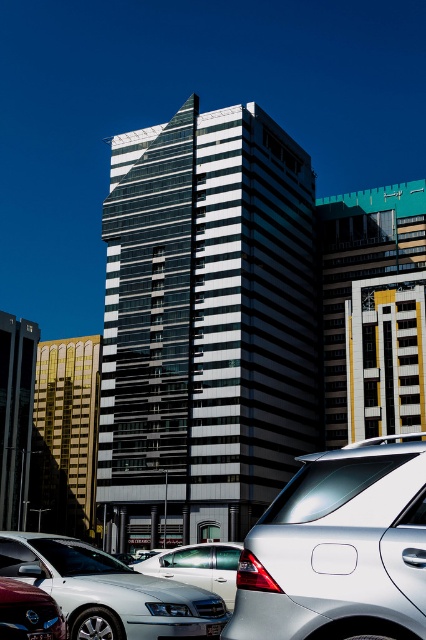
You are a photographer standing at the base of the highrise building. You want to capture a photo that includes both the point at coordinates point [39,573] and point [25,637]. Which point should be closer to the camera in your photo?

Point [39,573] is further to the camera than point [25,637], so in your photo, point [39,573] will be closer to the camera than point [25,637].

You are a parking attendant trying to locate a specific vehicle. You see the silver metallic sedan at center and the black plastic license plate at center. Which one is located to the left?

The silver metallic sedan at center is positioned on the left side of the black plastic license plate at center, so the silver metallic sedan at center is located to the left.

You are standing on the sidewalk in front of the highrise building and see a point at coordinates (108, 589). Which object is this point located on?

The point at coordinates (108, 589) is located on the silver metallic sedan at lower left.